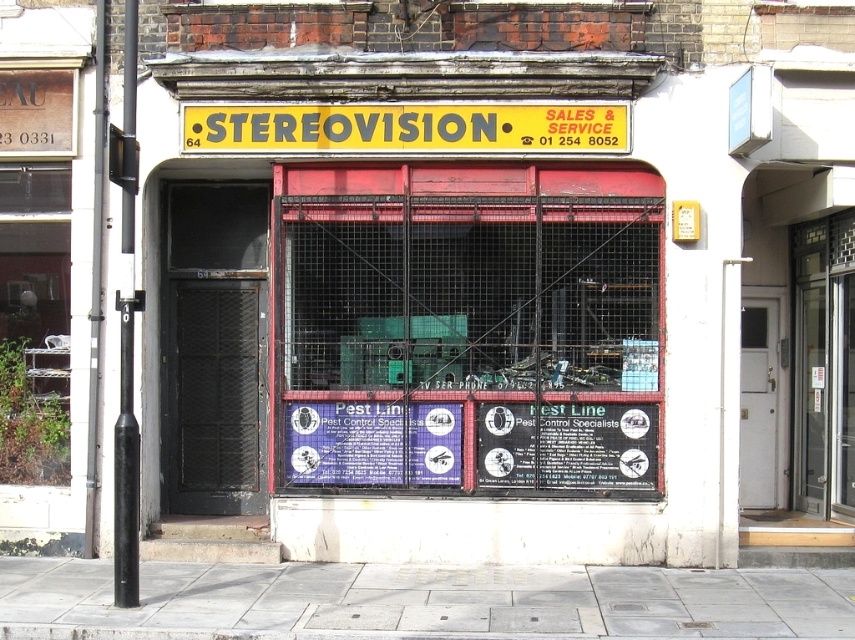
Question: Does metal mesh cage at center appear over blue paper sign at center?

Choices:
 (A) yes
 (B) no

Answer: (A)

Question: Which object appears closest to the camera in this image?

Choices:
 (A) yellow plastic sign at center
 (B) blue paper sign at center

Answer: (A)

Question: Is metal mesh cage at center behind yellow plastic sign at center?

Choices:
 (A) yes
 (B) no

Answer: (A)

Question: Is metal mesh cage at center above blue paper sign at center?

Choices:
 (A) yes
 (B) no

Answer: (A)

Question: Considering the real-world distances, which object is farthest from the blue paper sign at center?

Choices:
 (A) gray concrete sidewalk at lower center
 (B) black matte sign at center
 (C) metal mesh cage at center
 (D) yellow plastic sign at center

Answer: (D)

Question: Which point appears farthest from the camera in this image?

Choices:
 (A) (534, 442)
 (B) (410, 296)
 (C) (292, 403)

Answer: (C)